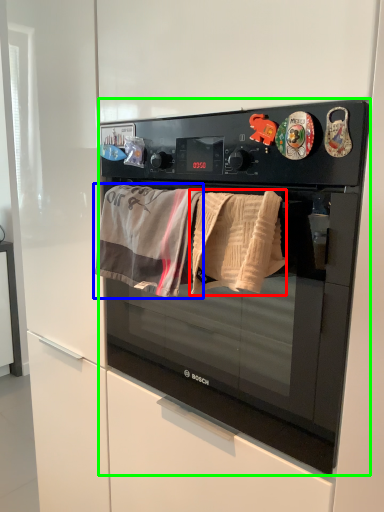
Question: Considering the real-world distances, which object is closest to beach towel (highlighted by a red box)? beach towel (highlighted by a blue box) or microwave oven (highlighted by a green box).

Choices:
 (A) beach towel
 (B) microwave oven

Answer: (A)